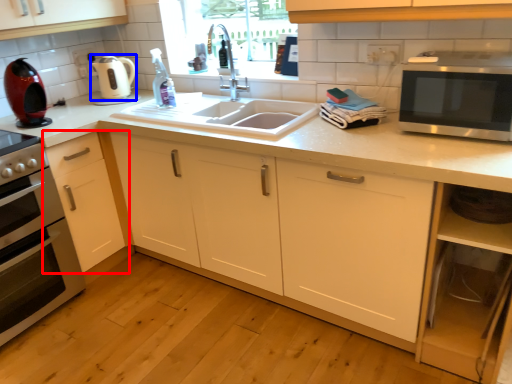
Question: Which object appears closest to the camera in this image, cabinetry (highlighted by a red box) or appliance (highlighted by a blue box)?

Choices:
 (A) cabinetry
 (B) appliance

Answer: (A)